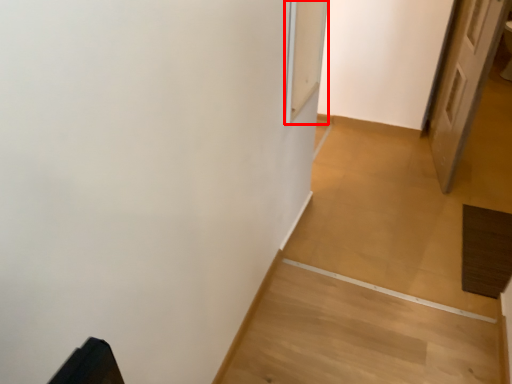
Question: From the image, what is the correct spatial relationship of screen door (annotated by the red box) in relation to door?

Choices:
 (A) left
 (B) right

Answer: (A)